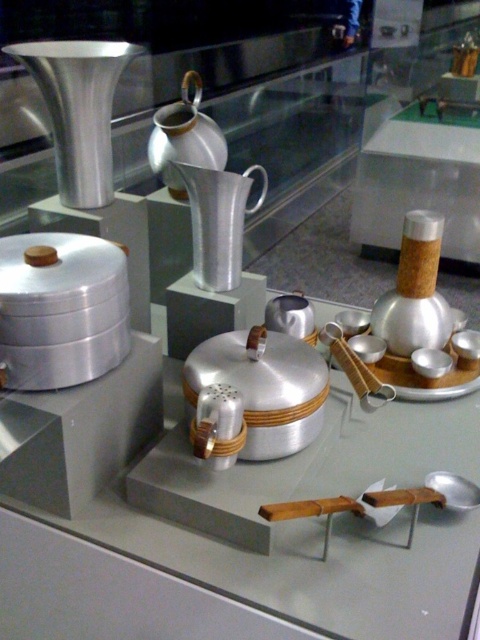
Is silver metallic pitcher at center below polished silver teapot at center?

Yes, silver metallic pitcher at center is below polished silver teapot at center.

I want to click on silver metallic pitcher at center, so click(x=218, y=221).

At what (x,y) coordinates should I click in order to perform the action: click on silver metallic pitcher at center. Please return your answer as a coordinate pair (x, y). The width and height of the screenshot is (480, 640). Looking at the image, I should click on pos(218,221).